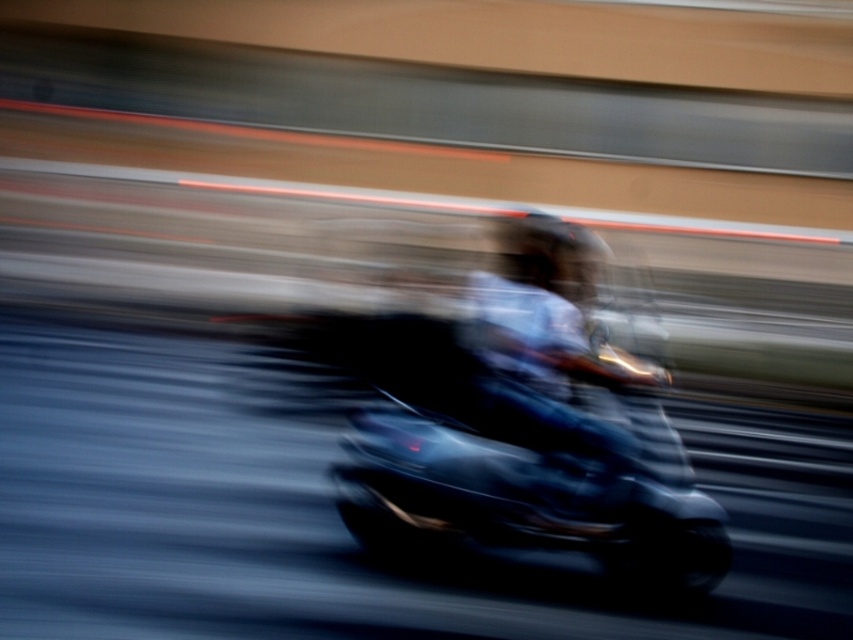
The width and height of the screenshot is (853, 640). What do you see at coordinates (523, 470) in the screenshot?
I see `shiny black motorcycle at center` at bounding box center [523, 470].

Between shiny black motorcycle at center and dark blue helmet at center, which one has more height?

shiny black motorcycle at center is taller.

The image size is (853, 640). In order to click on shiny black motorcycle at center in this screenshot , I will do `click(523, 470)`.